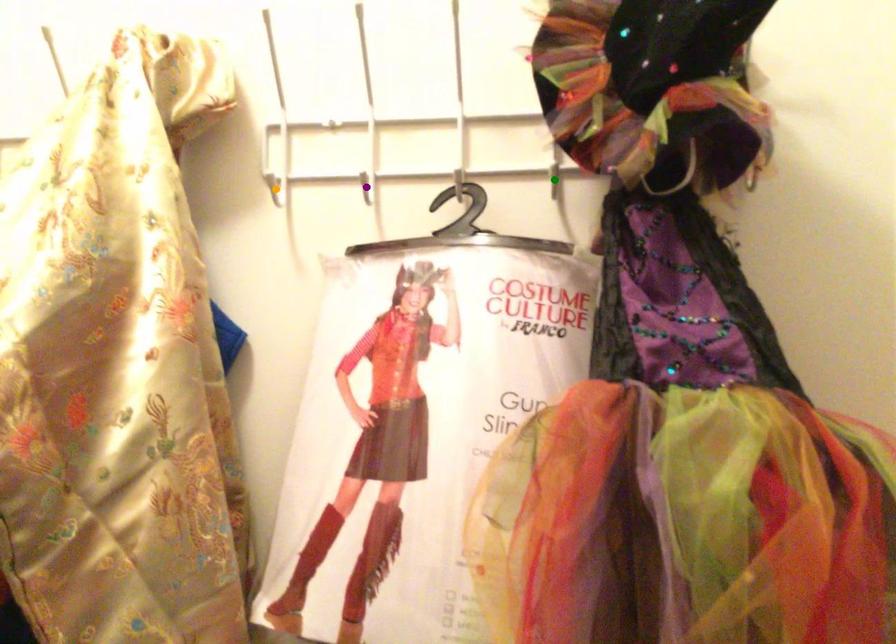
Order these from farthest to nearest:
green point | purple point | orange point

orange point → purple point → green point